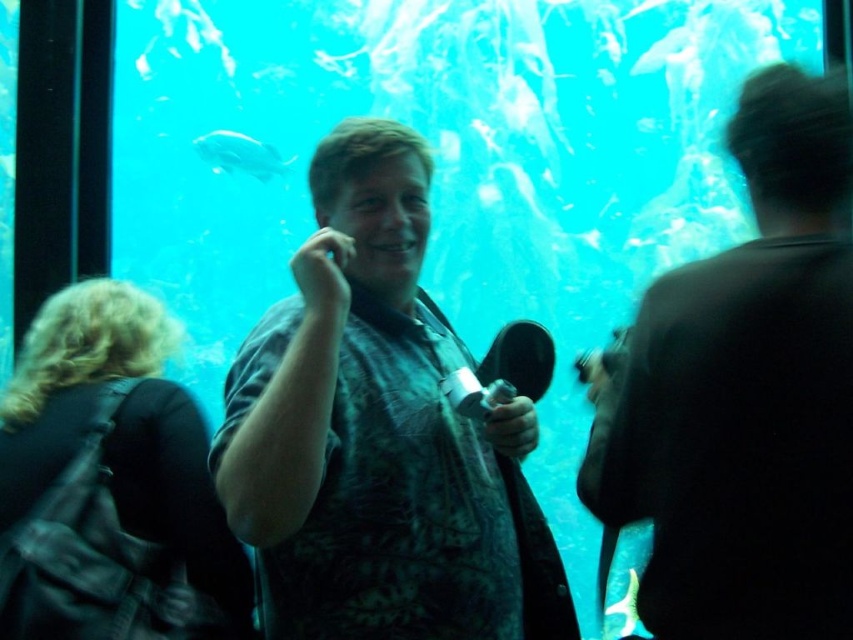
Does point (670, 352) lie behind point (656, 67)?

No, (670, 352) is in front of (656, 67).

In order to click on black matte shirt at upper right in this screenshot , I will do `click(746, 394)`.

Does point (778, 564) come farther from viewer compared to point (677, 42)?

No.

Find the location of a particular element. Image resolution: width=853 pixels, height=640 pixels. black matte shirt at upper right is located at coordinates (746, 394).

Is the position of green matte fish at center less distant than that of translucent blue fish at upper center?

Yes, green matte fish at center is in front of translucent blue fish at upper center.

This screenshot has height=640, width=853. What do you see at coordinates (622, 609) in the screenshot? I see `green matte fish at center` at bounding box center [622, 609].

Which is behind, point (624, 625) or point (668, 49)?

Positioned behind is point (668, 49).

Where is `green matte fish at center`? The width and height of the screenshot is (853, 640). green matte fish at center is located at coordinates (622, 609).

Can you confirm if dark hair at left is shorter than green matte fish at center?

Incorrect, dark hair at left's height does not fall short of green matte fish at center's.

Is dark hair at left positioned in front of green matte fish at center?

Yes.

Does point (33, 324) come behind point (630, 577)?

That is False.

Where is `dark hair at left`? dark hair at left is located at coordinates (109, 483).